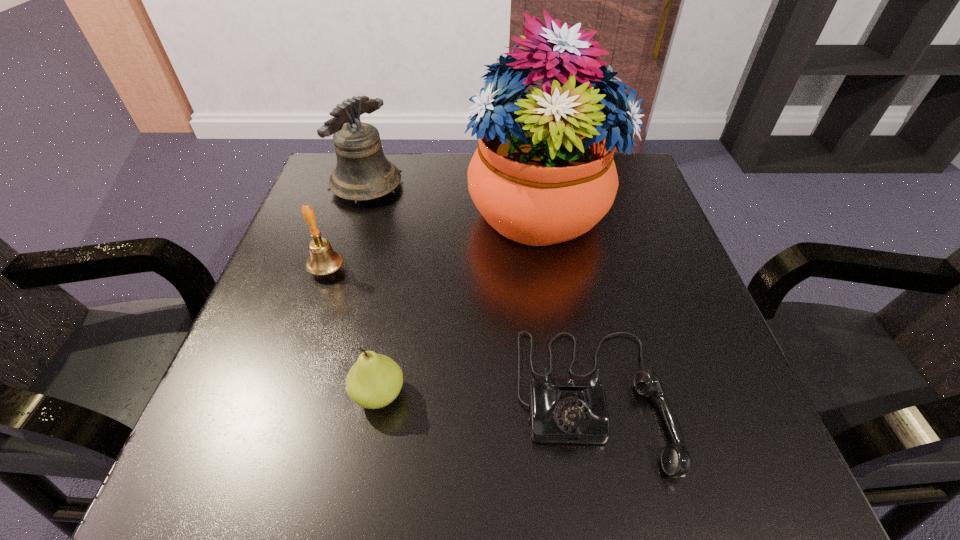
This screenshot has height=540, width=960. I want to click on the tallest object, so click(x=543, y=173).

I want to click on the taller bell, so click(362, 173).

Locate an element on the screen. This screenshot has height=540, width=960. the farther bell is located at coordinates (362, 173).

This screenshot has height=540, width=960. What are the coordinates of `the nearer bell` in the screenshot? It's located at [x=323, y=260].

You are a GUI agent. You are given a task and a screenshot of the screen. Output one action in this format:
    pyautogui.click(x=<x>, y=<y>)
    Task: Click on the third shortest object
    This screenshot has height=540, width=960.
    Given the screenshot: What is the action you would take?
    pyautogui.click(x=323, y=260)

Where is `pear`? This screenshot has height=540, width=960. pear is located at coordinates (375, 380).

The height and width of the screenshot is (540, 960). Identify the location of the shortest object. (562, 410).

Where is `free space located on the front of the flower arrangement`? This screenshot has width=960, height=540. free space located on the front of the flower arrangement is located at coordinates (552, 300).

At what (x,y) coordinates should I click in order to perform the action: click on free region located on the front of the farther bell. Please return your answer as a coordinate pair (x, y). This screenshot has height=540, width=960. Looking at the image, I should click on (x=353, y=231).

You are a GUI agent. You are given a task and a screenshot of the screen. Output one action in this format:
    pyautogui.click(x=<x>, y=<y>)
    Task: Click on the vacant space located 0.100m on the back of the shorter bell
    
    Given the screenshot: What is the action you would take?
    pyautogui.click(x=342, y=226)